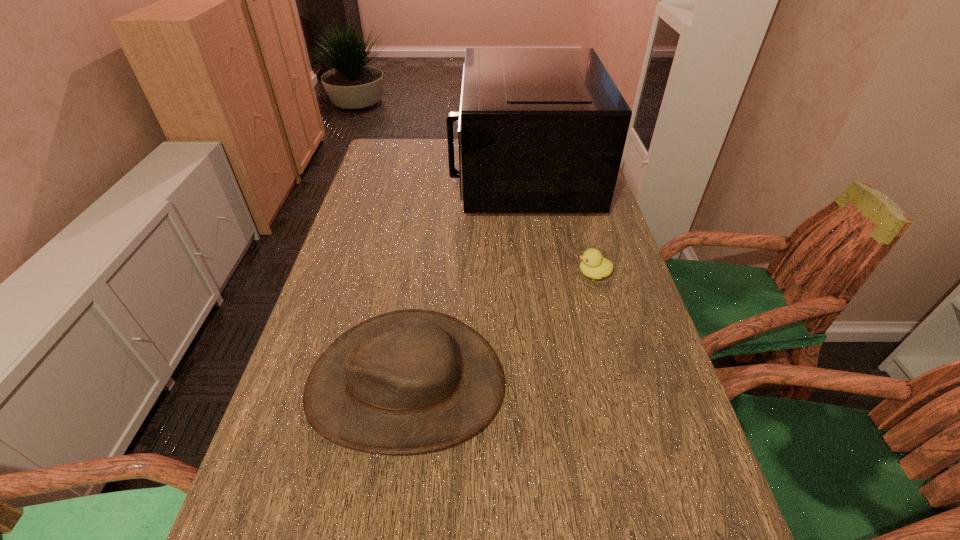
This screenshot has width=960, height=540. Identify the location of free point located at the beak of the duckling. coord(534,274).

Identify the location of free spot located at the beak of the duckling. (553, 274).

Locate an element on the screen. This screenshot has height=540, width=960. vacant region located at the beak of the duckling is located at coordinates click(468, 274).

Where is `object present at the far edge`? object present at the far edge is located at coordinates (541, 130).

Where is `object situated at the left edge`? The image size is (960, 540). object situated at the left edge is located at coordinates (411, 381).

Where is `microwave_oven that is at the right edge`? microwave_oven that is at the right edge is located at coordinates (541, 130).

The width and height of the screenshot is (960, 540). I want to click on duckling that is at the right edge, so click(593, 265).

The width and height of the screenshot is (960, 540). In order to click on object that is at the far right corner in this screenshot , I will do `click(541, 130)`.

The image size is (960, 540). I want to click on vacant space at the left edge of the desktop, so click(x=386, y=273).

In the image, there is a desktop. In order to click on vacant area at the right edge in this screenshot , I will do `click(574, 268)`.